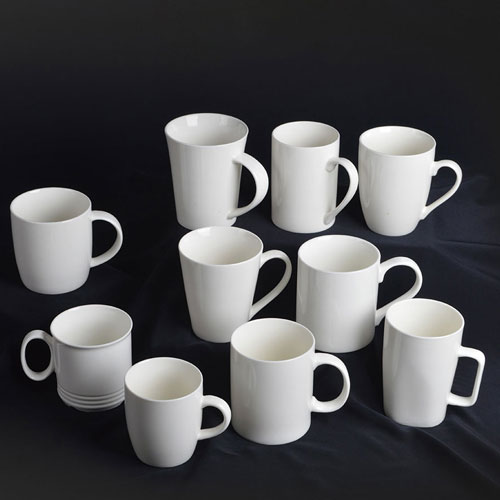
Image resolution: width=500 pixels, height=500 pixels. What are the coordinates of `rim of cup` in the screenshot? It's located at (166, 402), (275, 358), (347, 274), (427, 337), (405, 161), (309, 147), (209, 148), (225, 261), (93, 347), (55, 223).